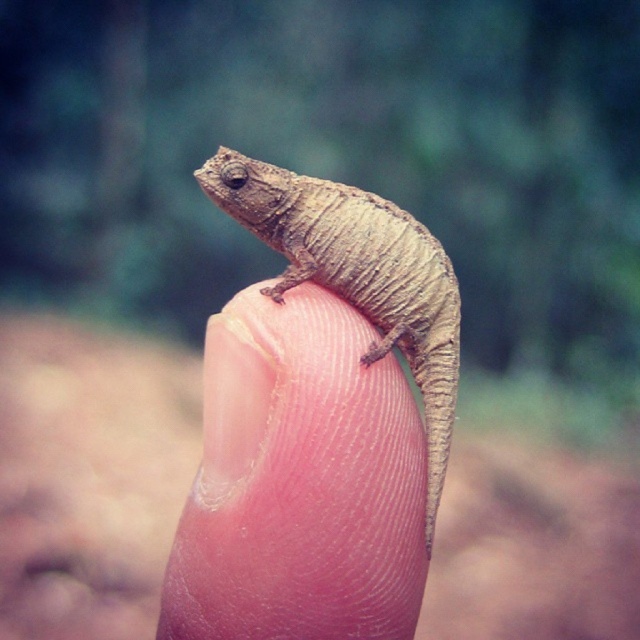
Which of these two, brown rough skin at center or brown textured lizard at center, stands shorter?

brown rough skin at center is shorter.

Who is lower down, brown rough skin at center or brown textured lizard at center?

brown rough skin at center is below.

Which is behind, point (387, 476) or point (381, 205)?

The point (381, 205) is more distant.

You are a GUI agent. You are given a task and a screenshot of the screen. Output one action in this format:
    pyautogui.click(x=<x>, y=<y>)
    Task: Click on the brown rough skin at center
    The width and height of the screenshot is (640, 640).
    Given the screenshot: What is the action you would take?
    pyautogui.click(x=300, y=483)